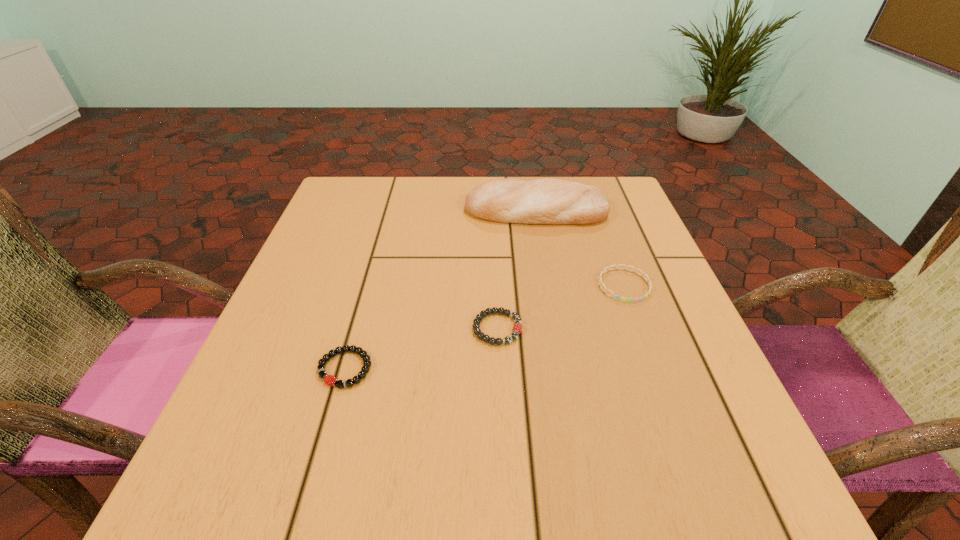
Where is `free spot that satisfies the following two spatial constraints: 1. on the back side of the tallest object; 2. on the left side of the nearest bracelet`? The width and height of the screenshot is (960, 540). free spot that satisfies the following two spatial constraints: 1. on the back side of the tallest object; 2. on the left side of the nearest bracelet is located at coordinates (390, 211).